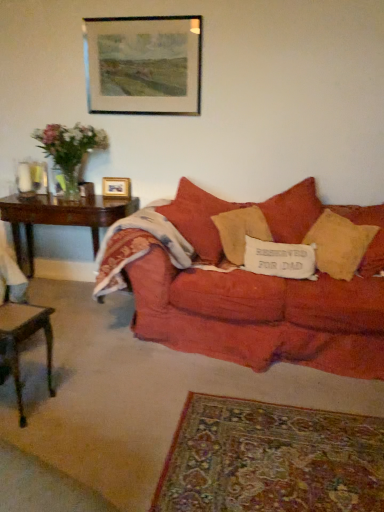
Question: Is matte red couch at center oriented towards translucent glass vase at left?

Choices:
 (A) yes
 (B) no

Answer: (B)

Question: Is matte red couch at center closer to camera compared to translucent glass vase at left?

Choices:
 (A) no
 (B) yes

Answer: (B)

Question: Is matte red couch at center to the right of translucent glass vase at left from the viewer's perspective?

Choices:
 (A) yes
 (B) no

Answer: (A)

Question: Is matte red couch at center completely or partially outside of translucent glass vase at left?

Choices:
 (A) yes
 (B) no

Answer: (A)

Question: From the image's perspective, does matte red couch at center appear higher than translucent glass vase at left?

Choices:
 (A) yes
 (B) no

Answer: (B)

Question: In the image, is translucent glass vase at left positioned in front of or behind clear glass vase at left?

Choices:
 (A) front
 (B) behind

Answer: (A)

Question: In the image, is translucent glass vase at left on the left side or the right side of clear glass vase at left?

Choices:
 (A) right
 (B) left

Answer: (A)

Question: From a real-world perspective, relative to clear glass vase at left, is translucent glass vase at left vertically above or below?

Choices:
 (A) below
 (B) above

Answer: (B)

Question: Considering the positions of translucent glass vase at left and clear glass vase at left in the image, is translucent glass vase at left taller or shorter than clear glass vase at left?

Choices:
 (A) short
 (B) tall

Answer: (B)

Question: Considering the relative positions of matte red couch at center and dark wood table at left, marked as the 1th table in a top-to-bottom arrangement, in the image provided, is matte red couch at center to the left or to the right of dark wood table at left, marked as the 1th table in a top-to-bottom arrangement,?

Choices:
 (A) left
 (B) right

Answer: (B)

Question: Is point (263, 309) closer or farther from the camera than point (49, 200)?

Choices:
 (A) farther
 (B) closer

Answer: (B)

Question: Considering the positions of matte red couch at center and dark wood table at left, marked as the 1th table in a top-to-bottom arrangement, in the image, is matte red couch at center wider or thinner than dark wood table at left, marked as the 1th table in a top-to-bottom arrangement,?

Choices:
 (A) wide
 (B) thin

Answer: (A)

Question: Considering the positions of matte red couch at center and dark wood table at left, marked as the 1th table in a top-to-bottom arrangement, in the image, is matte red couch at center bigger or smaller than dark wood table at left, marked as the 1th table in a top-to-bottom arrangement,?

Choices:
 (A) big
 (B) small

Answer: (A)

Question: From a real-world perspective, is wooden picture frame at upper center, the first picture frame when ordered from top to bottom, above or below matte red couch at center?

Choices:
 (A) above
 (B) below

Answer: (A)

Question: From the image's perspective, relative to matte red couch at center, is wooden picture frame at upper center, the 2th picture frame when ordered from back to front, above or below?

Choices:
 (A) above
 (B) below

Answer: (A)